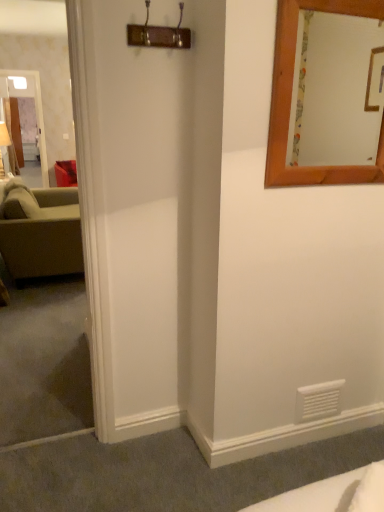
Question: Is point (48, 239) positioned closer to the camera than point (311, 13)?

Choices:
 (A) farther
 (B) closer

Answer: (B)

Question: Is green fabric couch at left in front of or behind wooden-framed mirror at upper right in the image?

Choices:
 (A) front
 (B) behind

Answer: (B)

Question: Estimate the real-world distances between objects in this image. Which object is farther from the green fabric couch at left?

Choices:
 (A) wooden-framed mirror at upper right
 (B) clear glass door at left

Answer: (B)

Question: Based on their relative distances, which object is nearer to the green fabric couch at left?

Choices:
 (A) wooden-framed mirror at upper right
 (B) clear glass door at left

Answer: (A)